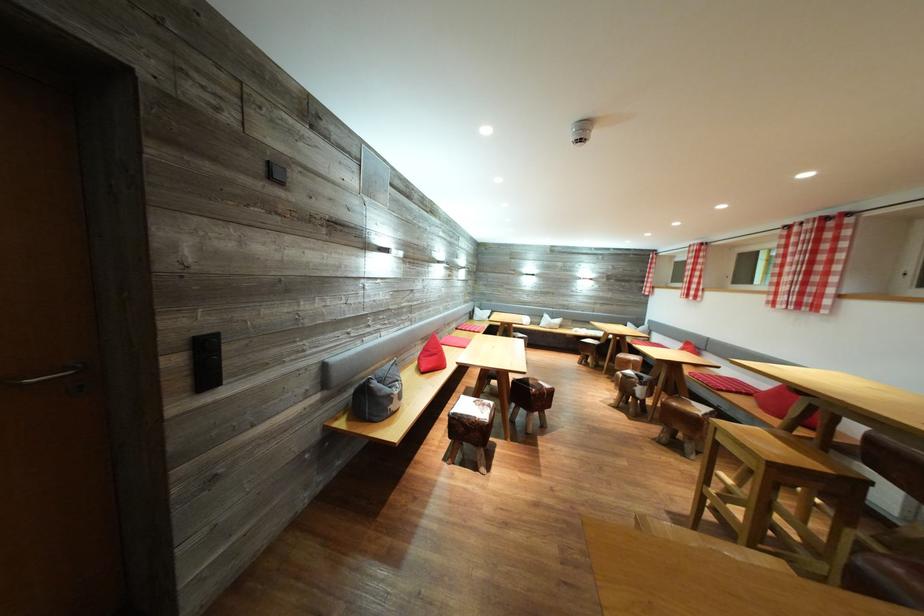
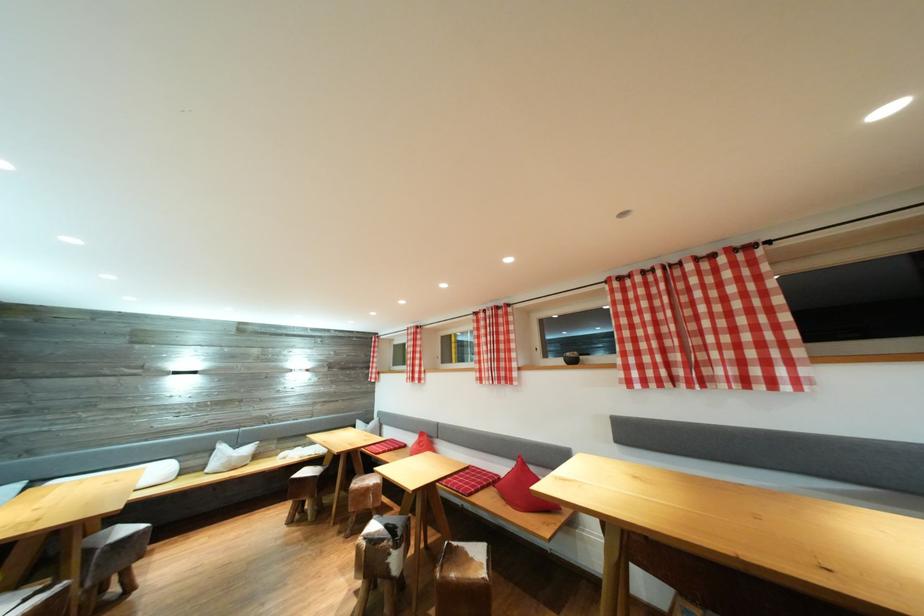
In the second image, find the point that corresponds to [701,269] in the first image.

(421, 351)